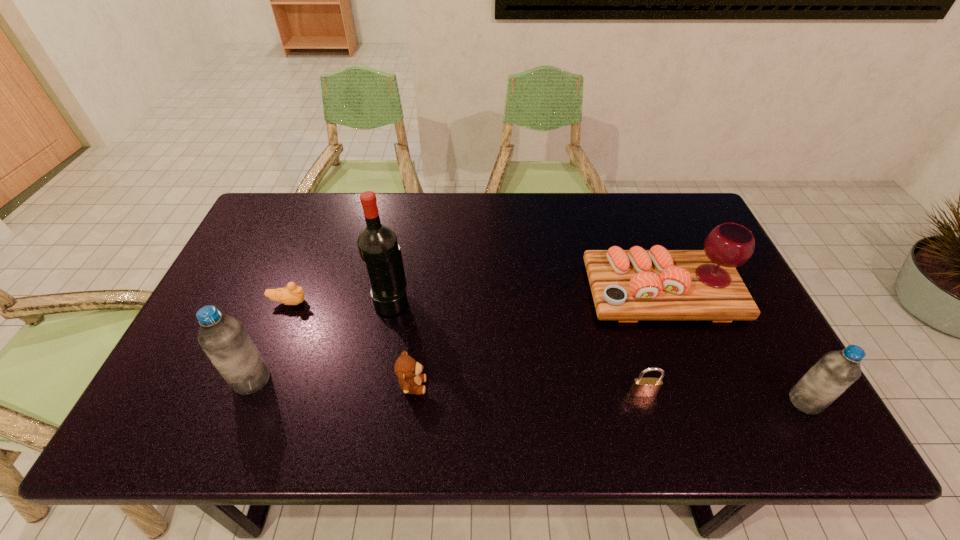
Locate an element on the screen. The height and width of the screenshot is (540, 960). the taller water bottle is located at coordinates click(223, 338).

Where is `the left water bottle`? the left water bottle is located at coordinates (223, 338).

Where is `the right water bottle`? the right water bottle is located at coordinates click(x=835, y=371).

Find the location of a particular element. The width and height of the screenshot is (960, 540). duckling is located at coordinates (291, 295).

Locate an element on the screen. This screenshot has height=540, width=960. platter is located at coordinates (658, 284).

Where is `the fifth object from right to left`? the fifth object from right to left is located at coordinates (378, 246).

Image resolution: width=960 pixels, height=540 pixels. I want to click on the tallest object, so click(x=378, y=246).

The image size is (960, 540). I want to click on padlock, so click(643, 387).

Locate an element on the screen. The height and width of the screenshot is (540, 960). teddy bear is located at coordinates (407, 369).

Identify the location of free spot located 0.350m on the right of the sixth shortest object. (418, 380).